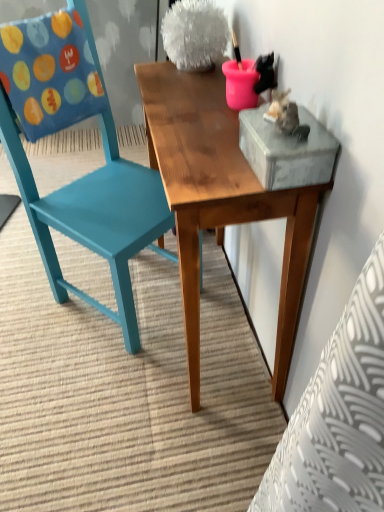
You are a GUI agent. You are given a task and a screenshot of the screen. Output one action in this format:
    pyautogui.click(x=<x>, y=<y>)
    Task: Click on the vacant area in front of teal painted wood chair at left
    
    Given the screenshot: What is the action you would take?
    pyautogui.click(x=97, y=395)